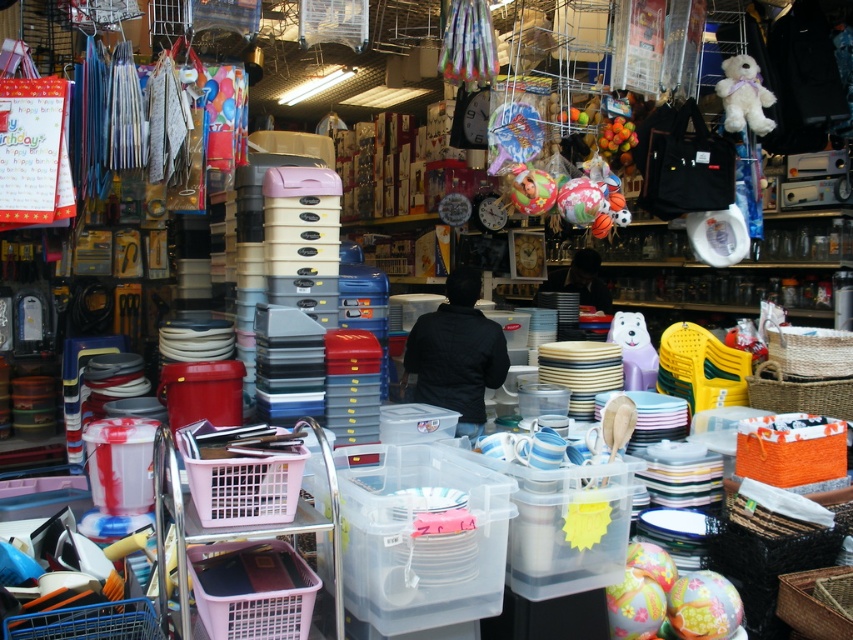
Measure the distance between black matte jacket at center and matte green ball at center.

The distance of black matte jacket at center from matte green ball at center is 3.98 feet.

Describe the element at coordinates (456, 353) in the screenshot. I see `black matte jacket at center` at that location.

Is point (447, 300) in front of point (514, 188)?

That is False.

Find the location of `black matte jacket at center`. black matte jacket at center is located at coordinates (456, 353).

Between point (738, 72) and point (520, 186), which one is positioned behind?

The point (738, 72) is behind.

Can you confirm if white plush bear at upper right is shorter than matte green ball at center?

In fact, white plush bear at upper right may be taller than matte green ball at center.

Is point (766, 118) in front of point (544, 179)?

No, it is behind (544, 179).

The image size is (853, 640). I want to click on white plush bear at upper right, so click(744, 96).

Image resolution: width=853 pixels, height=640 pixels. Describe the element at coordinates (744, 96) in the screenshot. I see `white plush bear at upper right` at that location.

This screenshot has height=640, width=853. I want to click on white plush bear at upper right, so click(x=744, y=96).